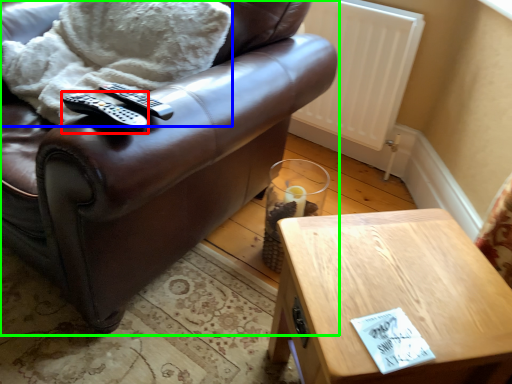
Question: Considering the real-world distances, which object is closest to remote (highlighted by a red box)? blanket (highlighted by a blue box) or chair (highlighted by a green box).

Choices:
 (A) blanket
 (B) chair

Answer: (A)